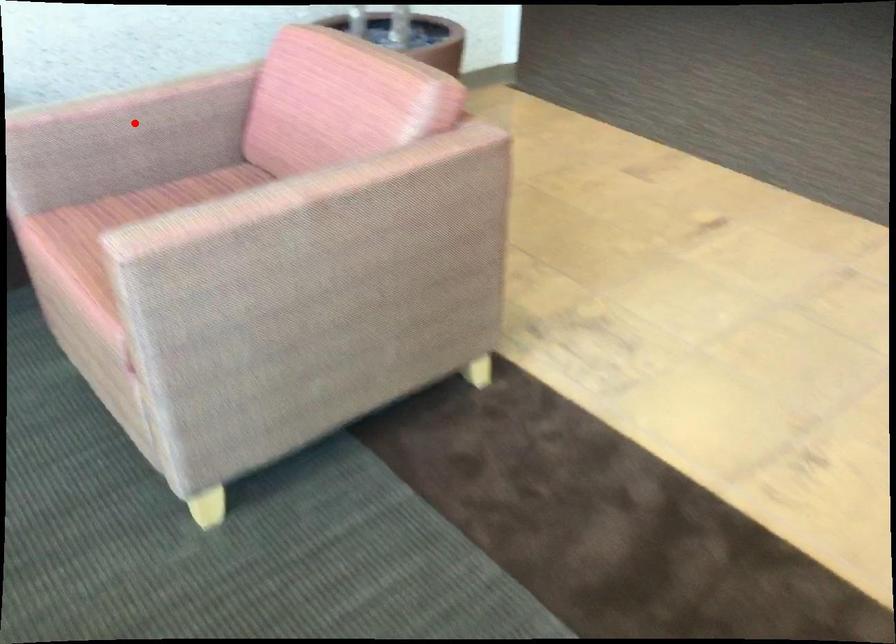
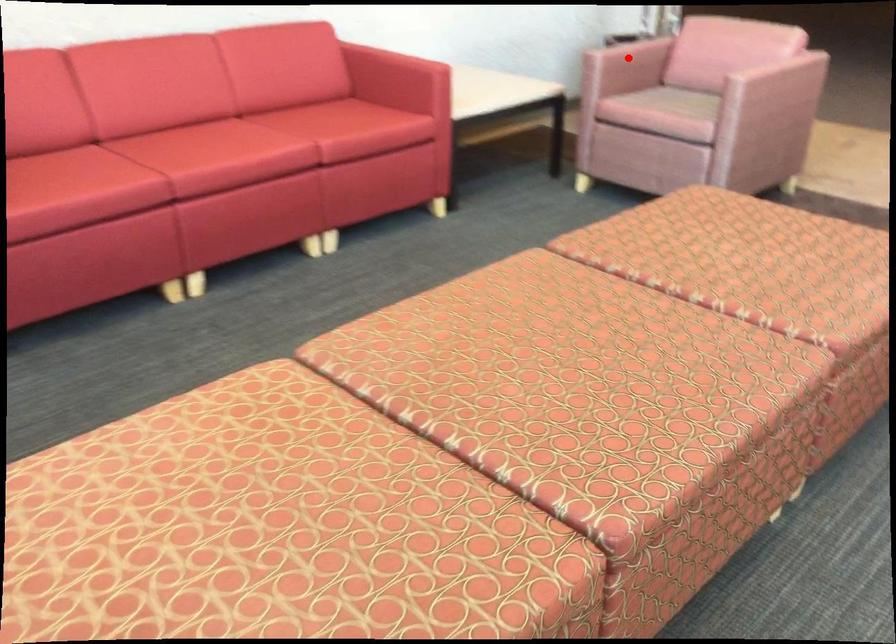
I am providing you with two images of the same scene from different viewpoints. A red point is marked on the first image and another point is marked on the second image. Are the points marked in image1 and image2 representing the same 3D position?

Yes